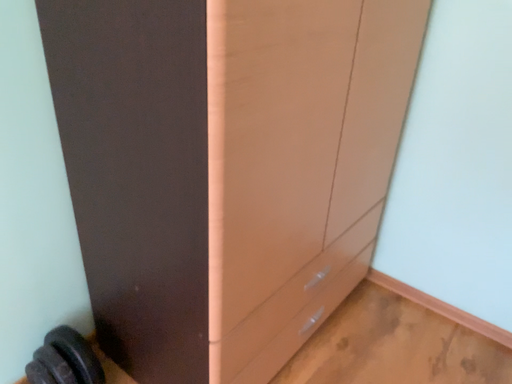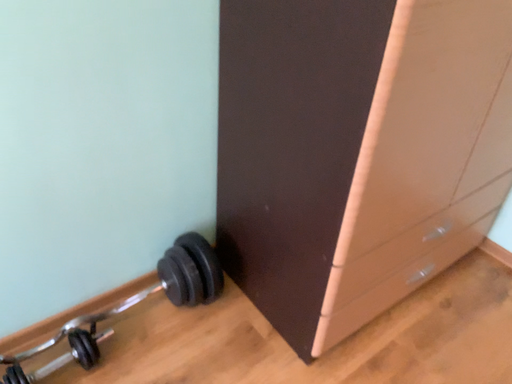
Question: How did the camera likely rotate when shooting the video?

Choices:
 (A) rotated right
 (B) rotated left

Answer: (B)